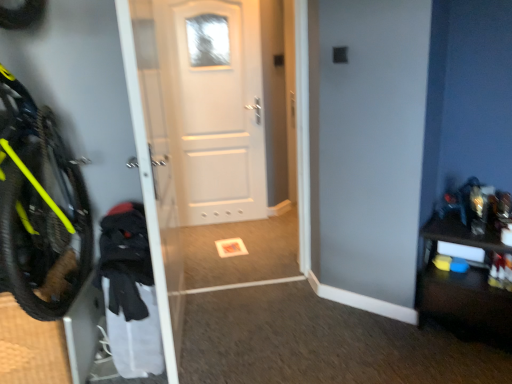
Question: Is dark wood dresser at right a part of white matte door at center?

Choices:
 (A) no
 (B) yes

Answer: (A)

Question: Is white matte door at center oriented towards dark wood dresser at right?

Choices:
 (A) yes
 (B) no

Answer: (B)

Question: Is white matte door at center positioned behind dark wood dresser at right?

Choices:
 (A) no
 (B) yes

Answer: (B)

Question: Is white matte door at center positioned in front of dark wood dresser at right?

Choices:
 (A) yes
 (B) no

Answer: (B)

Question: Is white matte door at center smaller than dark wood dresser at right?

Choices:
 (A) no
 (B) yes

Answer: (A)

Question: Does white matte door at center have a lesser height compared to dark wood dresser at right?

Choices:
 (A) no
 (B) yes

Answer: (A)

Question: Considering the relative sizes of dark wood dresser at right and white matte door at center in the image provided, is dark wood dresser at right shorter than white matte door at center?

Choices:
 (A) yes
 (B) no

Answer: (A)

Question: Are dark wood dresser at right and white matte door at center far apart?

Choices:
 (A) no
 (B) yes

Answer: (B)

Question: Can you confirm if dark wood dresser at right is wider than white matte door at center?

Choices:
 (A) yes
 (B) no

Answer: (A)

Question: Considering the relative sizes of dark wood dresser at right and white matte door at center in the image provided, is dark wood dresser at right smaller than white matte door at center?

Choices:
 (A) yes
 (B) no

Answer: (A)

Question: From a real-world perspective, is dark wood dresser at right located beneath white matte door at center?

Choices:
 (A) yes
 (B) no

Answer: (A)

Question: Is dark wood dresser at right outside white matte door at center?

Choices:
 (A) yes
 (B) no

Answer: (A)

Question: In terms of height, does dark wood dresser at right look taller or shorter compared to white matte door at center?

Choices:
 (A) tall
 (B) short

Answer: (B)